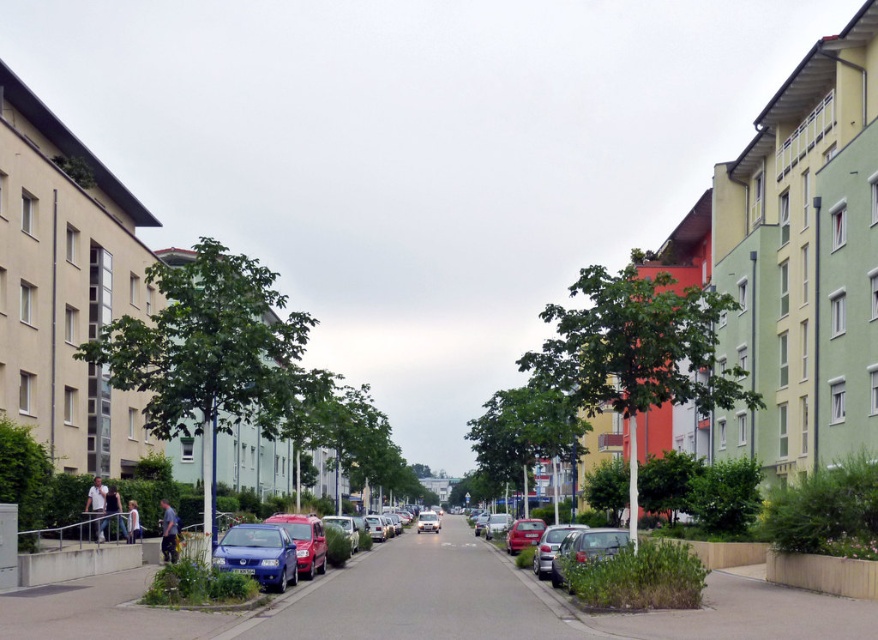
Looking at this image, between matte blue sedan at center and metallic silver sedan at lower right, which one is positioned lower?

matte blue sedan at center

Is matte blue sedan at center wider than metallic silver sedan at lower right?

Indeed, matte blue sedan at center has a greater width compared to metallic silver sedan at lower right.

Describe the element at coordinates (274, 548) in the screenshot. I see `matte blue sedan at center` at that location.

Locate an element on the screen. This screenshot has width=878, height=640. matte blue sedan at center is located at coordinates (274, 548).

Where is `matte silver sedan at lower right`? This screenshot has height=640, width=878. matte silver sedan at lower right is located at coordinates (572, 547).

Can you confirm if matte silver sedan at lower right is positioned above metallic blue car at center?

Yes, matte silver sedan at lower right is above metallic blue car at center.

Find the location of a particular element. matte silver sedan at lower right is located at coordinates (572, 547).

Is metallic blue car at center to the left of shiny red car at center from the viewer's perspective?

Yes, metallic blue car at center is to the left of shiny red car at center.

Does metallic blue car at center have a greater height compared to shiny red car at center?

Indeed, metallic blue car at center has a greater height compared to shiny red car at center.

Is point (304, 556) positioned in front of point (511, 548)?

Yes, it is in front of point (511, 548).

This screenshot has width=878, height=640. I want to click on metallic blue car at center, so click(304, 540).